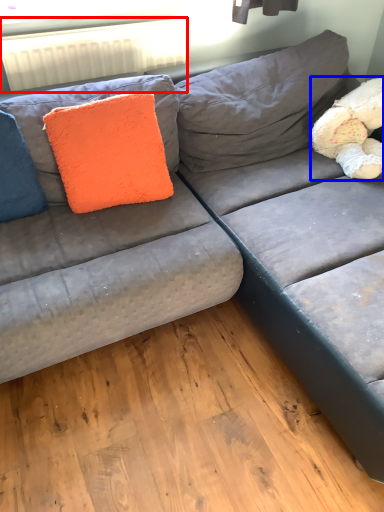
Question: Which object is further to the camera taking this photo, radiator (highlighted by a red box) or teddy (highlighted by a blue box)?

Choices:
 (A) radiator
 (B) teddy

Answer: (A)